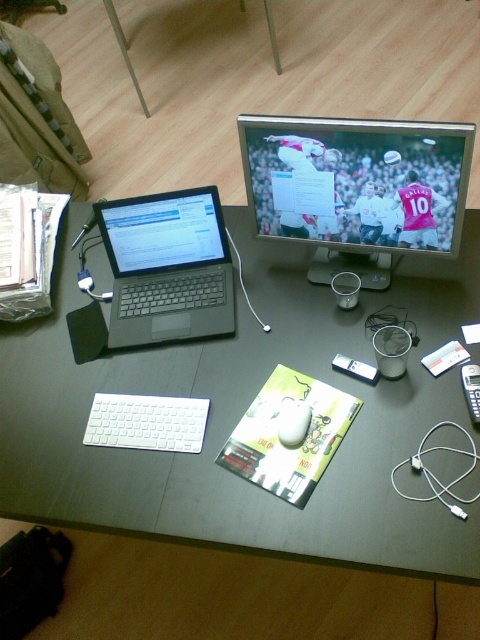
Question: Does matte black monitor at center come behind sleek black laptop at left?

Choices:
 (A) yes
 (B) no

Answer: (B)

Question: Does sleek black laptop at left lie in front of white matte mouse at center?

Choices:
 (A) no
 (B) yes

Answer: (A)

Question: Which point appears closest to the camera in this image?

Choices:
 (A) (382, 160)
 (B) (144, 260)
 (C) (95, 413)

Answer: (A)

Question: Which is farther from the dark wood table at center?

Choices:
 (A) white matte mouse at center
 (B) sleek black laptop at left
 (C) matte black monitor at center
 (D) white matte keyboard at center

Answer: (A)

Question: Is dark wood table at center thinner than sleek black laptop at left?

Choices:
 (A) yes
 (B) no

Answer: (B)

Question: Which point is closer to the camera taking this photo?

Choices:
 (A) click(x=178, y=426)
 (B) click(x=193, y=332)

Answer: (A)